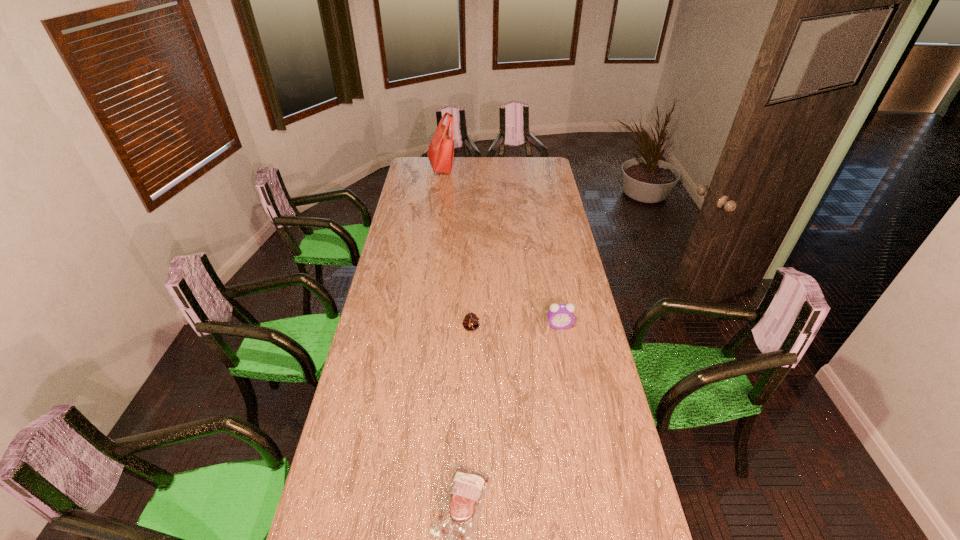
I want to click on vacant area that lies between the pinecone and the handbag, so click(x=456, y=248).

The height and width of the screenshot is (540, 960). What are the coordinates of `object that stands as the second closest to the handbag` in the screenshot? It's located at (560, 316).

You are a GUI agent. You are given a task and a screenshot of the screen. Output one action in this format:
    pyautogui.click(x=<x>, y=<y>)
    Task: Click on the object that is the second nearest to the handbag
    
    Given the screenshot: What is the action you would take?
    pyautogui.click(x=560, y=316)